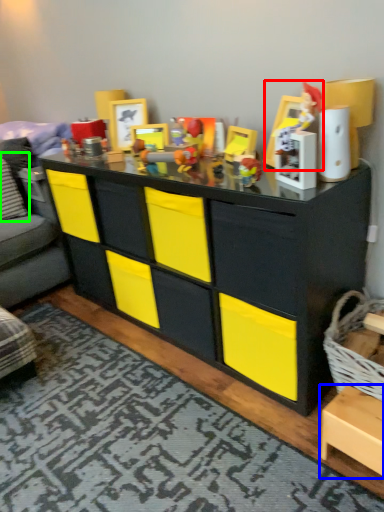
Question: Considering the real-world distances, which object is farthest from toy (highlighted by a red box)? cabinetry (highlighted by a blue box) or pillow (highlighted by a green box)?

Choices:
 (A) cabinetry
 (B) pillow

Answer: (B)